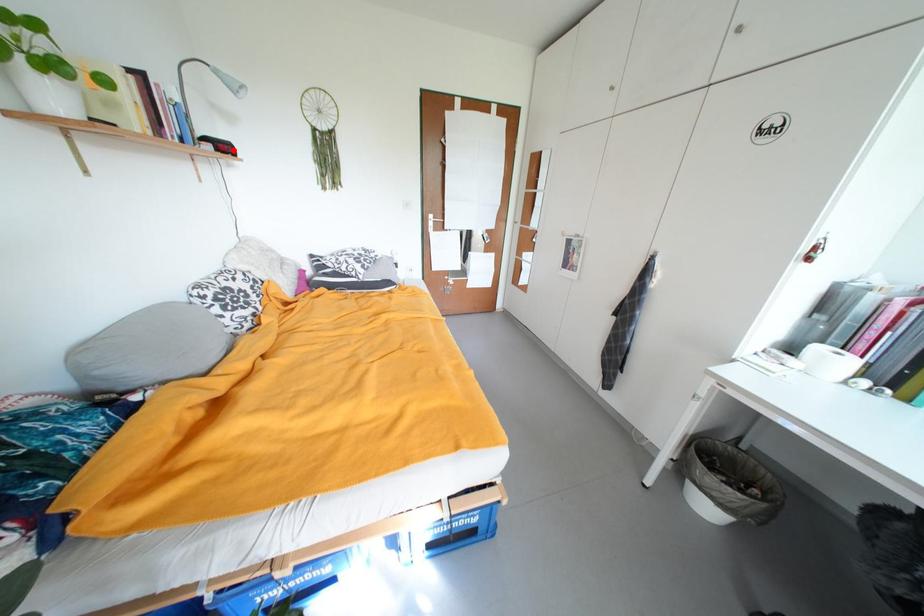
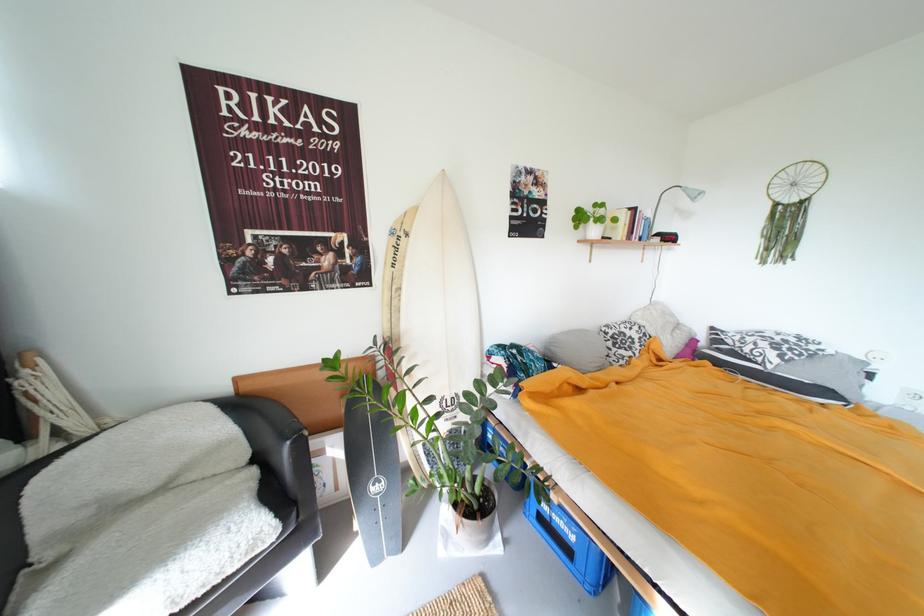
Locate, in the second image, the point that corresponds to the highlighted location in the first image.

(677, 240)